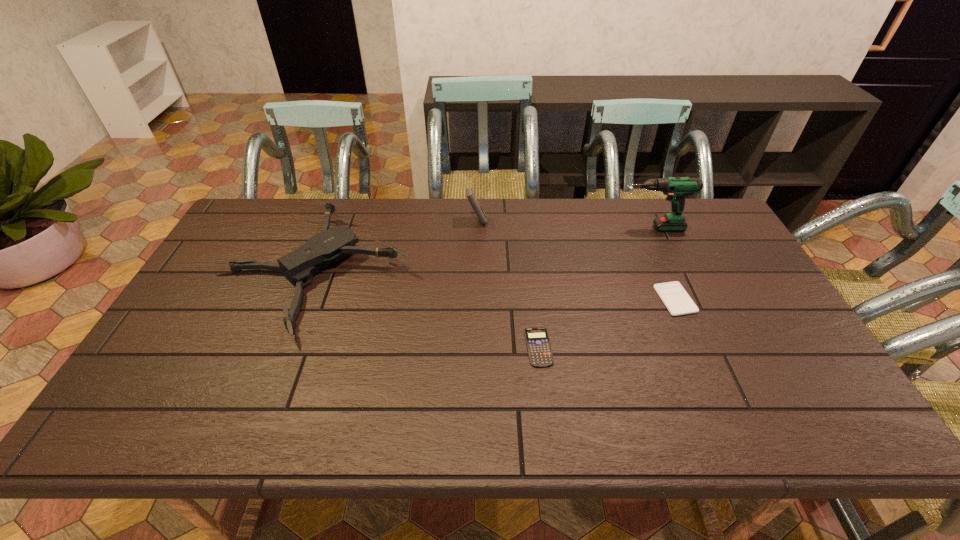
Where is `drill`? The width and height of the screenshot is (960, 540). drill is located at coordinates (676, 188).

Locate an element on the screen. the leftmost calculator is located at coordinates (470, 195).

Where is `the tallest calculator`? the tallest calculator is located at coordinates (470, 195).

This screenshot has width=960, height=540. Find the location of `the leftmost object`. the leftmost object is located at coordinates (320, 251).

This screenshot has width=960, height=540. I want to click on the third tallest object, so click(x=320, y=251).

In order to click on the second tallest calculator in this screenshot , I will do `click(678, 302)`.

Locate an element on the screen. The width and height of the screenshot is (960, 540). the rightmost calculator is located at coordinates (678, 302).

Locate an element on the screen. the shortest object is located at coordinates (540, 353).

Locate an element on the screen. The height and width of the screenshot is (540, 960). the third object from right to left is located at coordinates (540, 353).

What are the coordinates of `free point located on the handle side of the drill` in the screenshot? It's located at (597, 228).